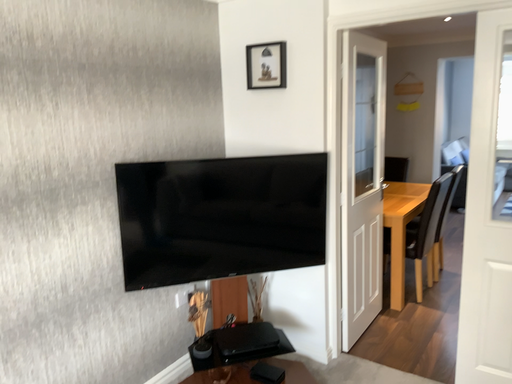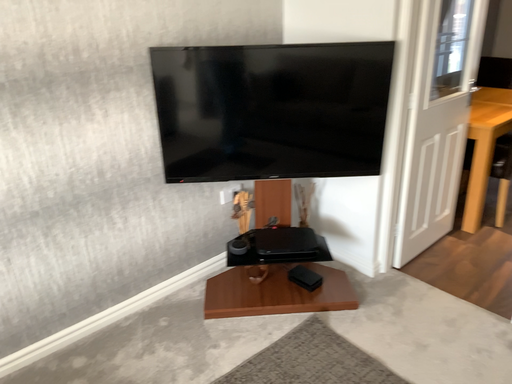
Question: Which way did the camera rotate in the video?

Choices:
 (A) rotated downward
 (B) rotated upward

Answer: (A)